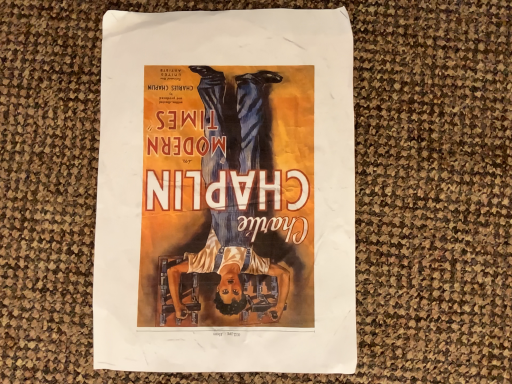
Looking at this image, in order to face matte paper poster at center, should I rotate leftwards or rightwards?

You should look left and rotate roughly 4.746 degrees.

Describe the element at coordinates (226, 193) in the screenshot. I see `matte paper poster at center` at that location.

At what (x,y) coordinates should I click in order to perform the action: click on matte paper poster at center. Please return your answer as a coordinate pair (x, y). The width and height of the screenshot is (512, 384). Looking at the image, I should click on (226, 193).

What is the approximate width of matte paper poster at center?

It is 12.36 inches.

Where is `matte paper poster at center`? This screenshot has width=512, height=384. matte paper poster at center is located at coordinates (226, 193).